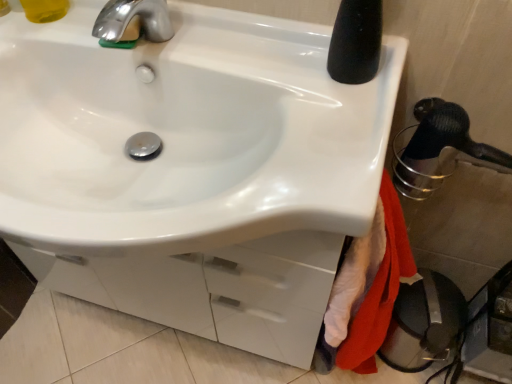
This screenshot has height=384, width=512. Find the location of `vacant space that is to the left of shiny metallic faucet at upper left`. vacant space that is to the left of shiny metallic faucet at upper left is located at coordinates click(58, 34).